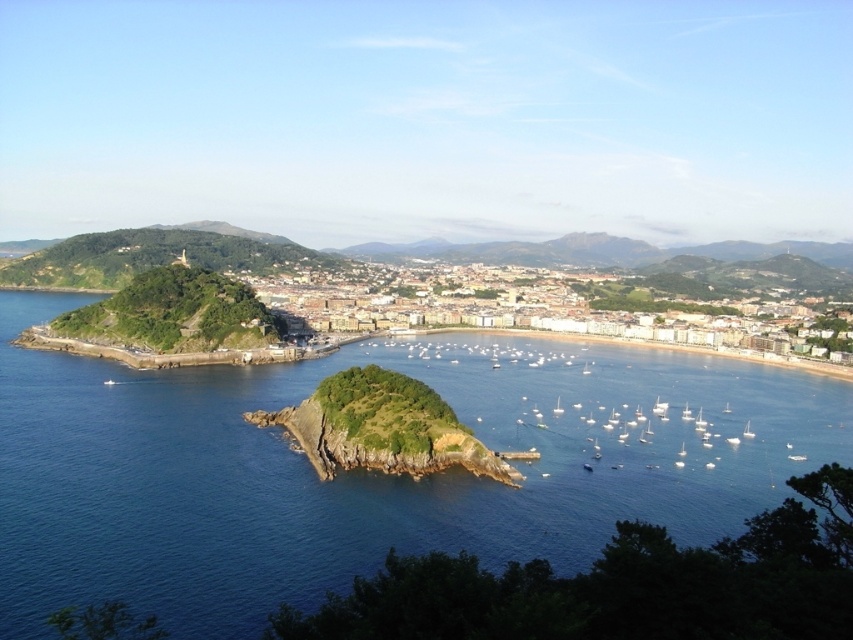
You are standing at the edge of the rocky outcrop in the foreground and want to take a photo that includes both the blue water at center and the green grassy hillside at center. Which object should you pan your camera to the right to include first?

You should pan your camera to the right to include the green grassy hillside at center first because the blue water at center is positioned on the left side of it.

You are standing at the point marked as point (363, 470) in the image. What do you see directly in front of you?

At point (363, 470) lies blue water at center, so you see blue water at center directly in front of you.

You are a photographer planning to capture the entire scene from a vantage point that allows both the blue water at center and the green grassy hillside at center to be visible. Which object will appear closer to the bottom of your photo?

The blue water at center will appear closer to the bottom of the photo because it is shorter than the green grassy hillside at center.